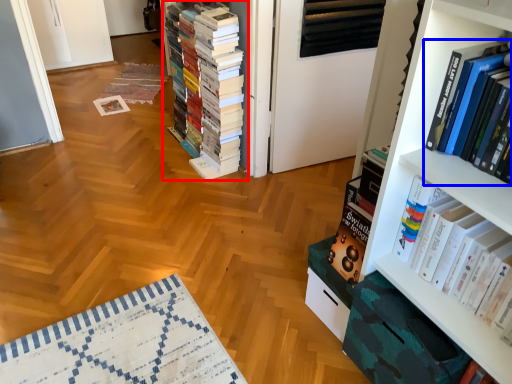
Question: Which object is closer to the camera taking this photo, book (highlighted by a red box) or book (highlighted by a blue box)?

Choices:
 (A) book
 (B) book

Answer: (B)